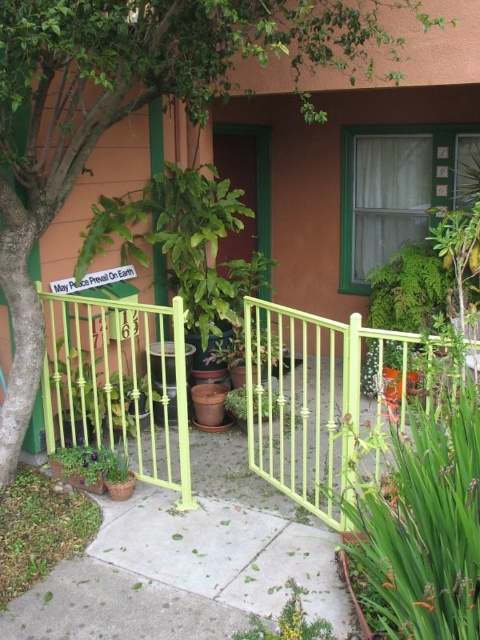
Question: Which object is closer to the camera taking this photo?

Choices:
 (A) light green metal gate at center
 (B) gray concrete pavement at center
 (C) green leafy tree at center
 (D) green matte door at center

Answer: (C)

Question: Can you confirm if light green metal gate at center is smaller than green matte door at center?

Choices:
 (A) yes
 (B) no

Answer: (B)

Question: Which point is farther to the camera?

Choices:
 (A) green matte door at center
 (B) green leafy tree at center
 (C) green leafy plant at lower right

Answer: (A)

Question: Which object appears closest to the camera in this image?

Choices:
 (A) green leafy plant at lower right
 (B) green matte door at center
 (C) light green metal gate at center

Answer: (A)

Question: Is green leafy tree at center above light green metal gate at center?

Choices:
 (A) yes
 (B) no

Answer: (A)

Question: Can you confirm if gray concrete pavement at center is smaller than green leafy plant at center?

Choices:
 (A) no
 (B) yes

Answer: (B)